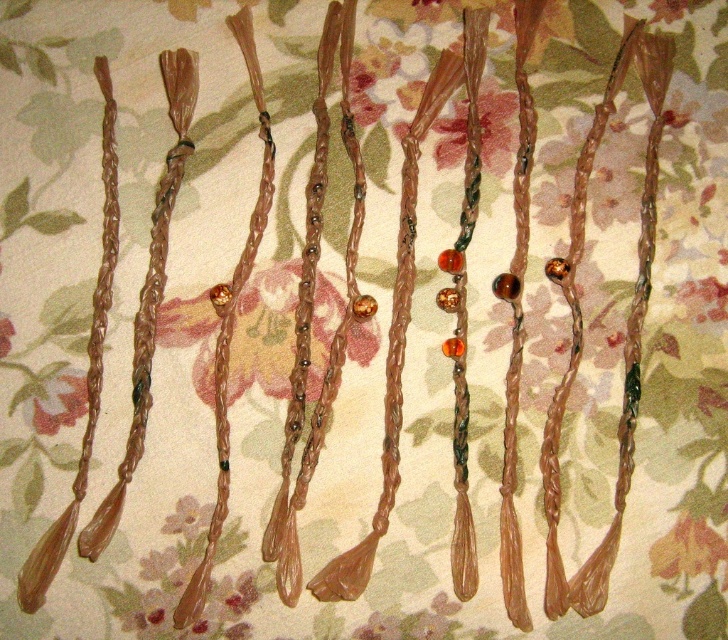
In the scene shown: Which is above, translucent plastic flower at center or matte floral fabric at lower left?

Positioned higher is translucent plastic flower at center.

Does translucent plastic flower at center have a lesser height compared to matte floral fabric at lower left?

No, translucent plastic flower at center is not shorter than matte floral fabric at lower left.

Is point (499, 136) positioned behind point (55, 420)?

Yes, point (499, 136) is farther from viewer.

Where is `translucent plastic flower at center`? translucent plastic flower at center is located at coordinates (496, 125).

Between translucent amber beads at center and matte floral fabric at lower left, which one is positioned higher?

Positioned higher is translucent amber beads at center.

Who is more distant from viewer, (312, 352) or (84, 403)?

Point (312, 352)

Identify the location of translucent amber beads at center. (265, 332).

Is translucent amber beads at center below translucent plastic flower at center?

Yes.

Describe the element at coordinates (265, 332) in the screenshot. This screenshot has width=728, height=640. I see `translucent amber beads at center` at that location.

Find the location of `translucent amber beads at center`. translucent amber beads at center is located at coordinates (265, 332).

Identify the location of translucent amber beads at center. The height and width of the screenshot is (640, 728). (265, 332).